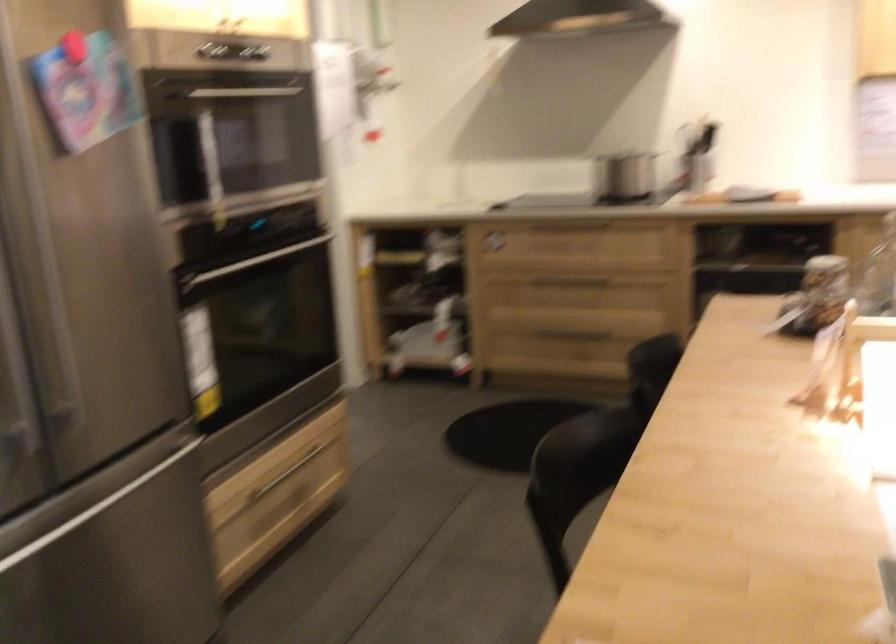
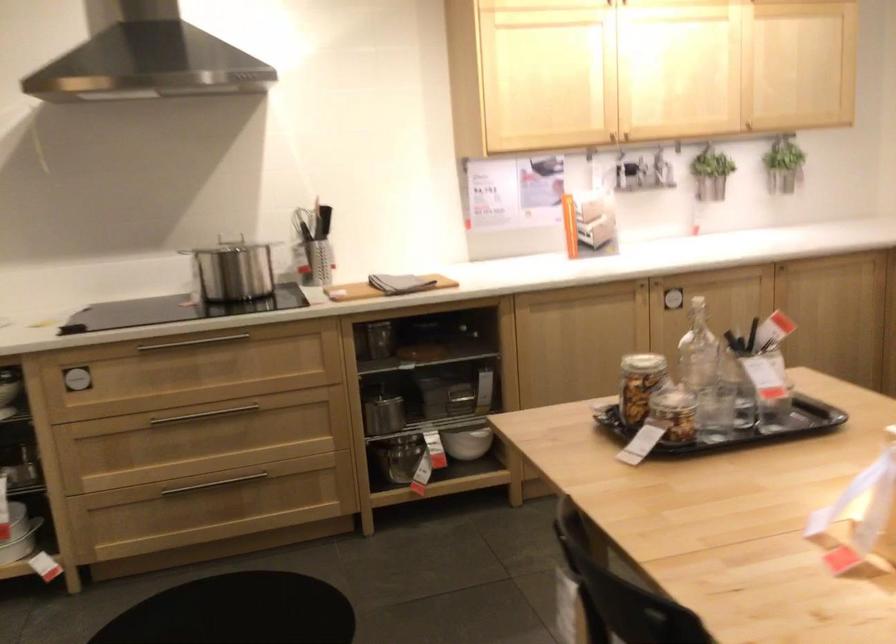
Find the pixel in the second image that matches point (821, 279) in the first image.

(640, 384)